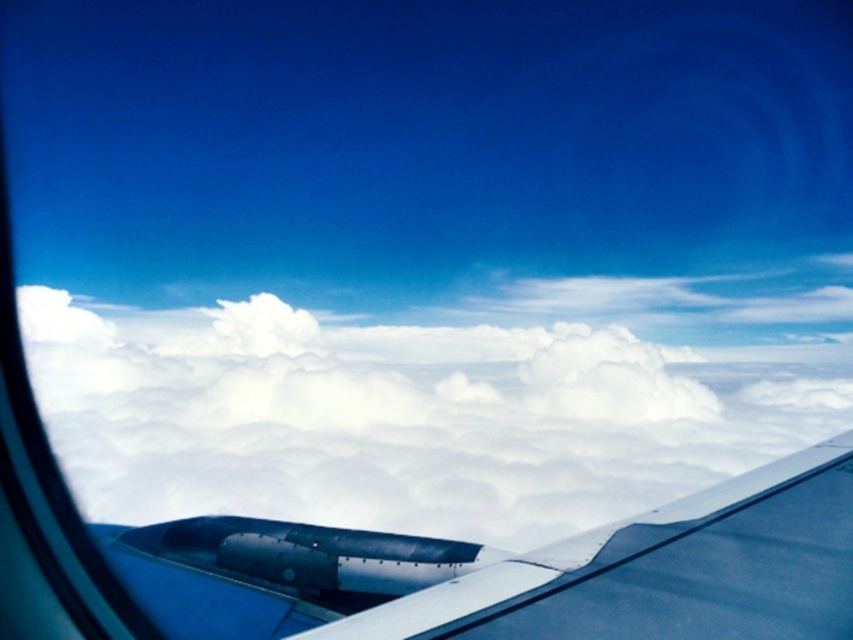
You are a pilot flying at an altitude of 100 meters. You notice a metallic blue wing at lower right and a white fluffy cloud at center. How far apart are these two objects from each other?

The white fluffy cloud at center is 105.12 meters away from the metallic blue wing at lower right.

You are sitting in a window seat on an airplane and see two points marked in the scene. The first point is at coordinates point (610, 516) and the second is at point (619, 563). From your seat, which point do you think is closer to you?

Point (610, 516) is closer to you because it is further to the viewer than point (619, 563).

You are a pilot flying at an altitude of 180 feet. You look out the window and see the white fluffy cloud at center. Can you safely fly through it without hitting the cloud?

The white fluffy cloud at center is 181.08 feet away from the camera, which is slightly higher than your current altitude of 180 feet. Therefore, you are just below the cloud and can safely fly through it without hitting it.